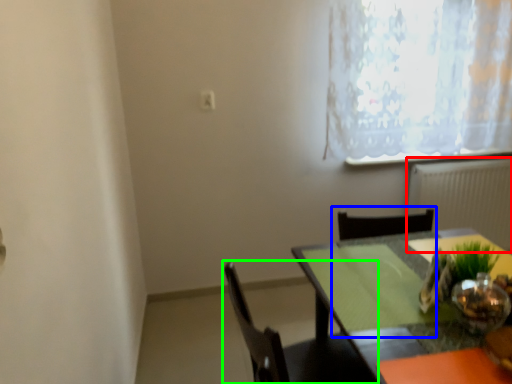
Question: Which is nearer to the radiator (highlighted by a red box)? chair (highlighted by a blue box) or chair (highlighted by a green box).

Choices:
 (A) chair
 (B) chair

Answer: (A)